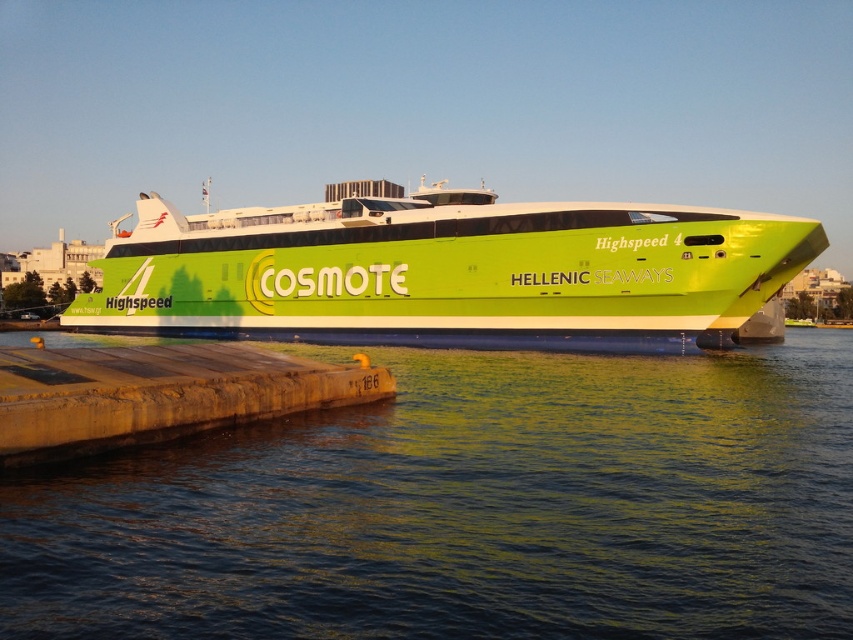
You are standing on the pier and want to board the Highspeed 4 ferry. The ferry is docked at the pier, and you see the green reflective water at lower center. Where is the green reflective water located relative to the ferry?

The green reflective water at lower center is located at point (469,508) relative to the ferry.